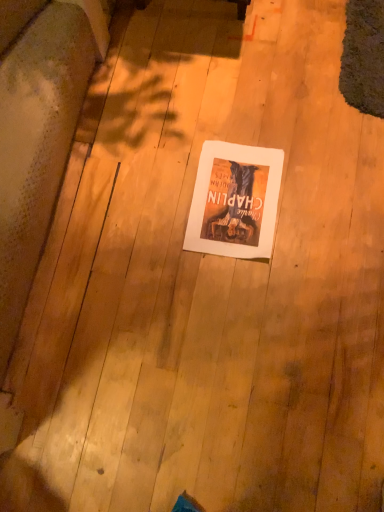
Identify the location of vacant space situated on the left part of white paper poster at center. (147, 221).